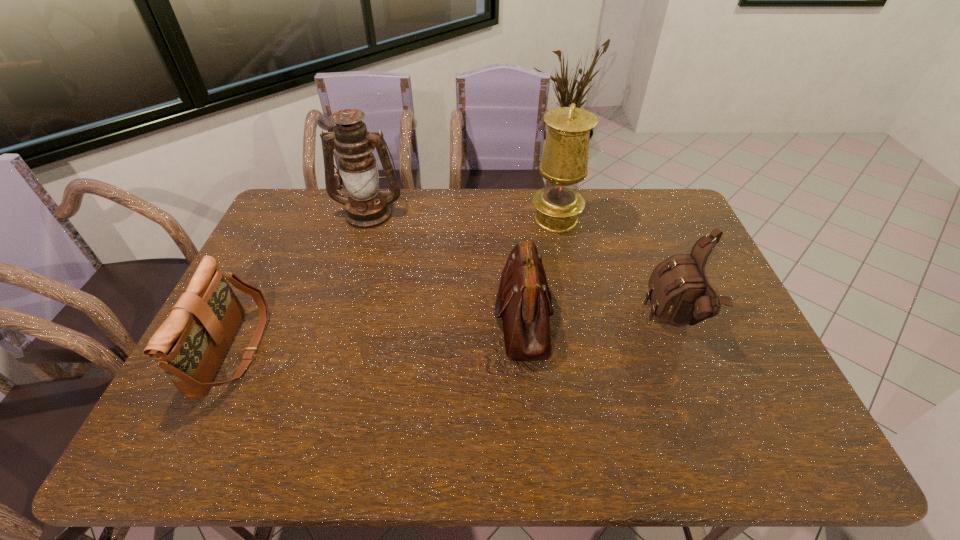
The height and width of the screenshot is (540, 960). I want to click on the right lantern, so click(x=564, y=162).

Locate an element on the screen. This screenshot has height=540, width=960. the left lantern is located at coordinates pyautogui.click(x=366, y=208).

Locate an element on the screen. the rightmost shoulder bag is located at coordinates (680, 294).

Locate an element on the screen. This screenshot has height=540, width=960. the second shoulder bag from left to right is located at coordinates (524, 302).

You are a GUI agent. You are given a task and a screenshot of the screen. Output one action in this format:
    pyautogui.click(x=<x>, y=<y>)
    Task: Click on the leftmost shoulder bag
    
    Given the screenshot: What is the action you would take?
    pyautogui.click(x=189, y=346)

The width and height of the screenshot is (960, 540). I want to click on blank space located 0.240m on the right of the right lantern, so click(649, 220).

Image resolution: width=960 pixels, height=540 pixels. I want to click on free location located 0.180m on the right of the fourth object from right to left, so click(454, 214).

At what (x,y) coordinates should I click in order to perform the action: click on vacant space located on the front-facing side of the rightmost shoulder bag. Please return your answer as a coordinate pair (x, y). Image resolution: width=960 pixels, height=540 pixels. Looking at the image, I should click on (574, 322).

Where is `blank area located 0.280m on the front-facing side of the rightmost shoulder bag`? blank area located 0.280m on the front-facing side of the rightmost shoulder bag is located at coordinates (549, 322).

You are a GUI agent. You are given a task and a screenshot of the screen. Output one action in this format:
    pyautogui.click(x=<x>, y=<y>)
    Task: Click on the free space located on the front-facing side of the rightmost shoulder bag
    
    Given the screenshot: What is the action you would take?
    539,322